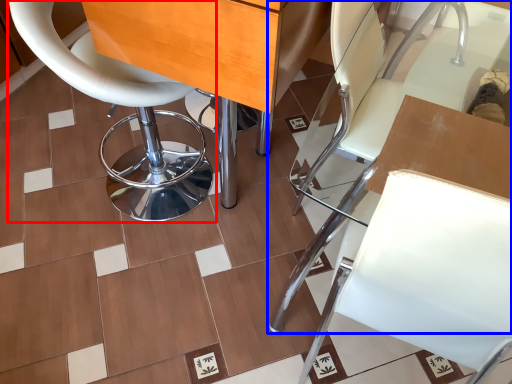
Question: Which object is further to the camera taking this photo, chair (highlighted by a red box) or chair (highlighted by a blue box)?

Choices:
 (A) chair
 (B) chair

Answer: (A)